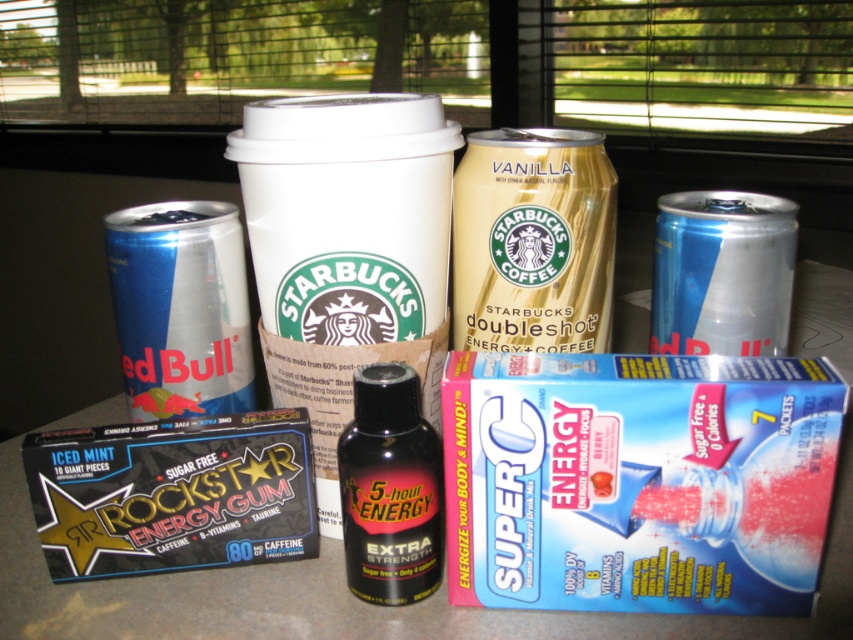
Question: Which point is closer to the camera?

Choices:
 (A) blue metallic can at left
 (B) gold metallic can at center
 (C) blue metallic can at upper right
 (D) black plastic bottle at center

Answer: (D)

Question: Does blue metallic can at upper right have a smaller size compared to black plastic bottle at center?

Choices:
 (A) no
 (B) yes

Answer: (A)

Question: Which point is closer to the camera?

Choices:
 (A) (180, 256)
 (B) (384, 540)
 (C) (581, 182)

Answer: (B)

Question: Can you confirm if gold metallic can at center is positioned to the left of blue metallic can at left?

Choices:
 (A) yes
 (B) no

Answer: (B)

Question: Which of the following is the closest to the observer?

Choices:
 (A) (738, 307)
 (B) (579, 288)
 (C) (198, 392)
 (D) (357, 410)

Answer: (D)

Question: Where is gold metallic can at center located in relation to black plastic bottle at center in the image?

Choices:
 (A) above
 (B) below

Answer: (A)